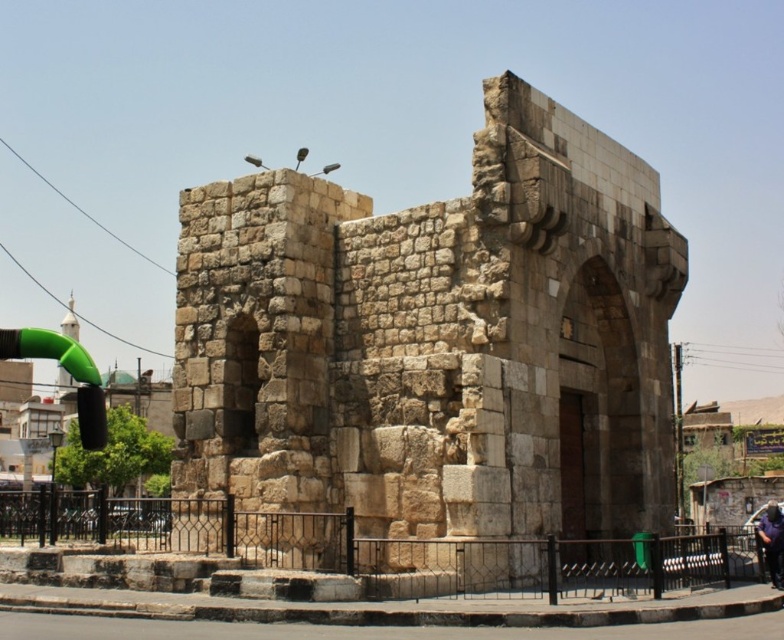
Does stone archway at center come behind dark blue shirt at lower right?

No, it is in front of dark blue shirt at lower right.

Does point (267, 346) come in front of point (775, 566)?

No, it is not.

Locate an element on the screen. The image size is (784, 640). stone archway at center is located at coordinates (437, 340).